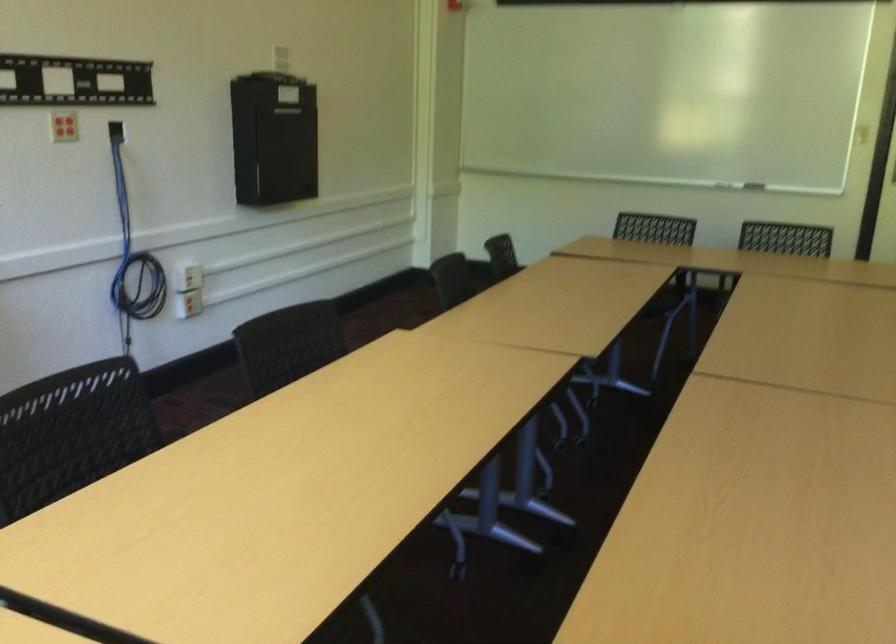
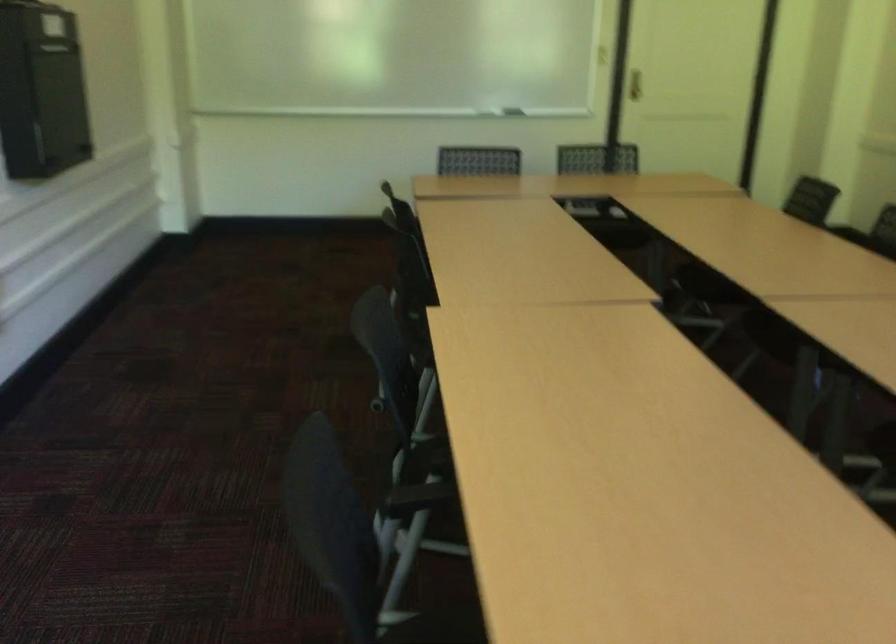
What movement of the cameraman would produce the second image?

The movement direction of the cameraman is left, forward.